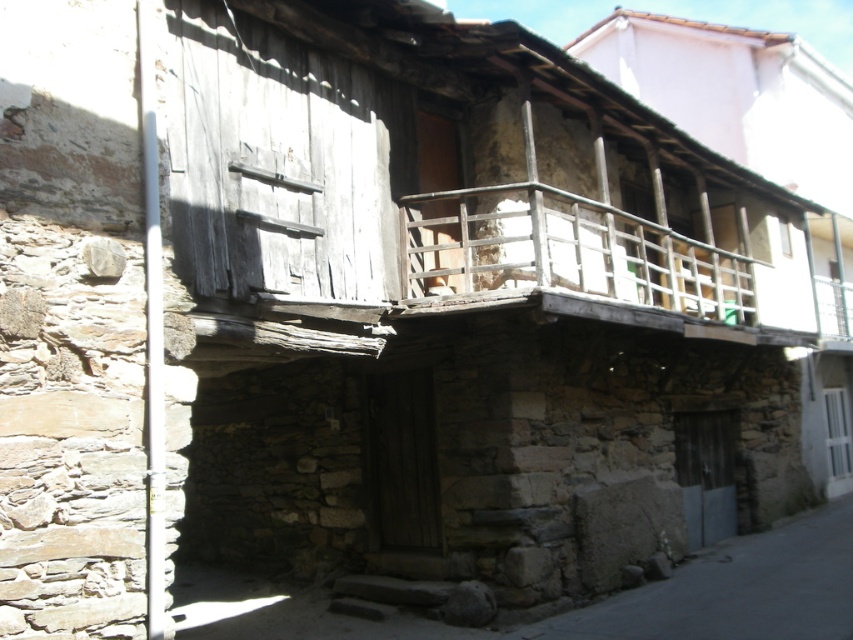
Question: Is wooden railing at upper center closer to the viewer compared to wooden at upper center?

Choices:
 (A) no
 (B) yes

Answer: (B)

Question: Does weathered wood shutter at left have a greater width compared to gray stone alley at lower right?

Choices:
 (A) yes
 (B) no

Answer: (A)

Question: Does weathered wood shutter at left appear on the left side of gray stone alley at lower right?

Choices:
 (A) no
 (B) yes

Answer: (B)

Question: Which point is closer to the camera?

Choices:
 (A) gray stone alley at lower right
 (B) wooden at upper center
 (C) weathered wood shutter at left

Answer: (C)

Question: Which object appears closest to the camera in this image?

Choices:
 (A) wooden at upper center
 (B) gray stone alley at lower right
 (C) weathered wood shutter at left

Answer: (C)

Question: Which object is the closest to the wooden railing at upper center?

Choices:
 (A) weathered wood shutter at left
 (B) wooden at upper center

Answer: (A)